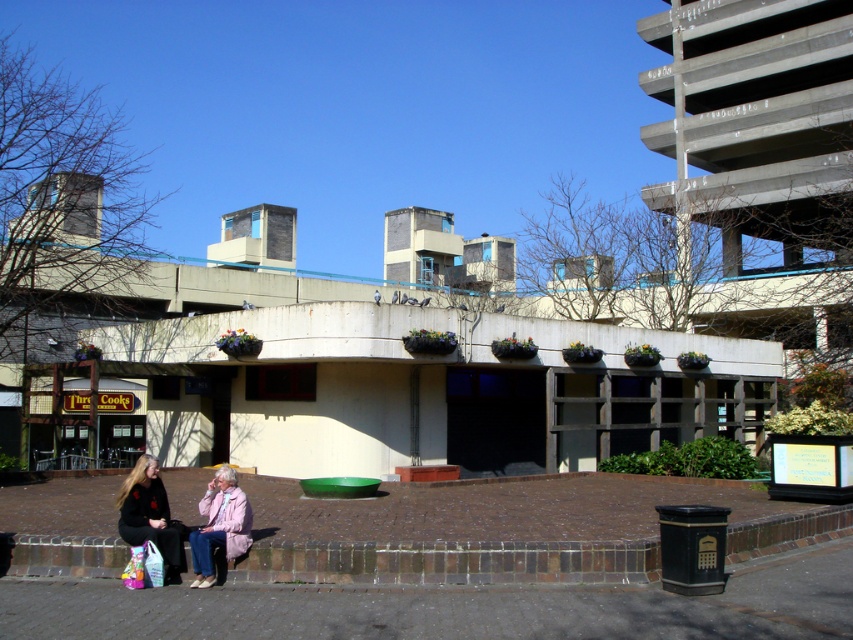
Which is more to the right, brown brick pavement at lower center or light pink fabric coat at lower left?

Positioned to the right is brown brick pavement at lower center.

Is brown brick pavement at lower center closer to camera compared to light pink fabric coat at lower left?

Yes, it is.

You are a GUI agent. You are given a task and a screenshot of the screen. Output one action in this format:
    pyautogui.click(x=<x>, y=<y>)
    Task: Click on the brown brick pavement at lower center
    
    Given the screenshot: What is the action you would take?
    pyautogui.click(x=450, y=608)

Is brown brick pavement at lower center positioned behind black fabric jacket at lower left?

No.

The image size is (853, 640). Describe the element at coordinates (450, 608) in the screenshot. I see `brown brick pavement at lower center` at that location.

Is point (294, 596) positioned in front of point (143, 536)?

Yes, point (294, 596) is closer to viewer.

Locate an element on the screen. The width and height of the screenshot is (853, 640). brown brick pavement at lower center is located at coordinates (450, 608).

Between black fabric jacket at lower left and light pink fabric coat at lower left, which one is positioned lower?

Positioned lower is light pink fabric coat at lower left.

Image resolution: width=853 pixels, height=640 pixels. What do you see at coordinates (149, 515) in the screenshot? I see `black fabric jacket at lower left` at bounding box center [149, 515].

Locate an element on the screen. Image resolution: width=853 pixels, height=640 pixels. black fabric jacket at lower left is located at coordinates (149, 515).